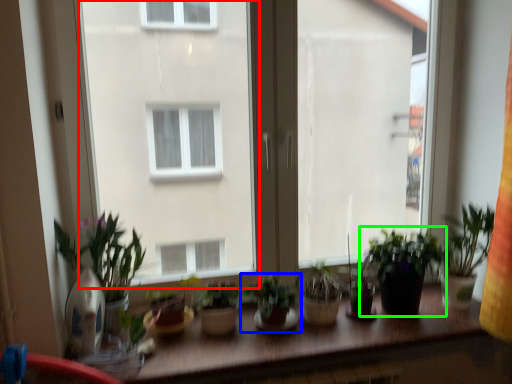
Question: Which is nearer to the window screen (highlighted by a red box)? houseplant (highlighted by a blue box) or houseplant (highlighted by a green box).

Choices:
 (A) houseplant
 (B) houseplant

Answer: (B)